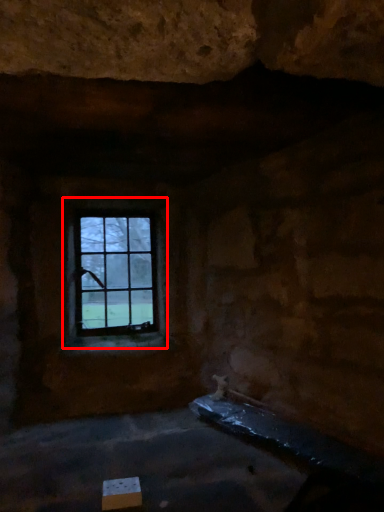
Question: From the image, what is the correct spatial relationship of window (annotated by the red box) in relation to cardboard box?

Choices:
 (A) left
 (B) right

Answer: (A)